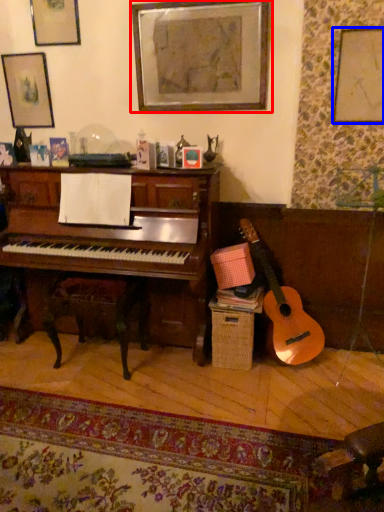
Question: Which point is further to the camera, picture frame (highlighted by a red box) or picture frame (highlighted by a blue box)?

Choices:
 (A) picture frame
 (B) picture frame

Answer: (A)